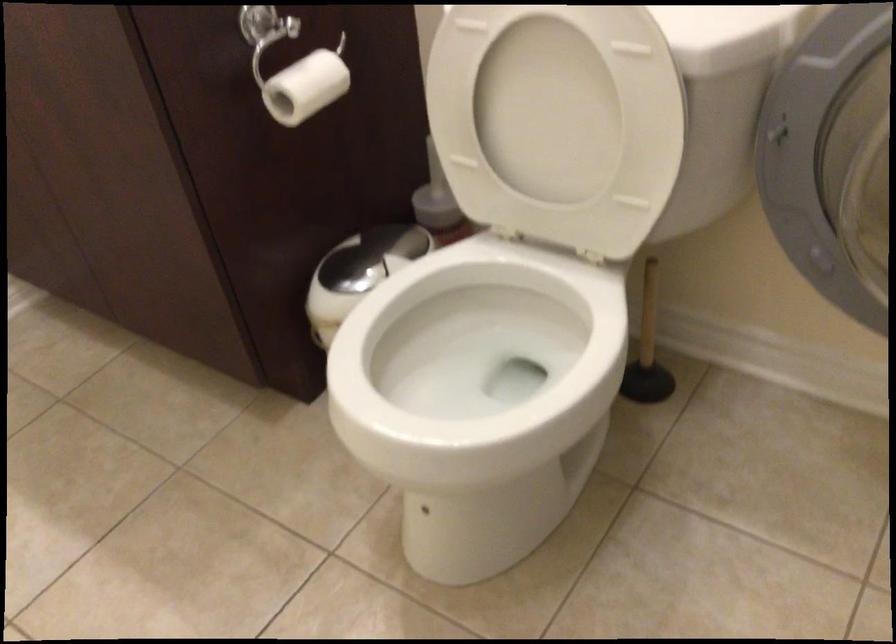
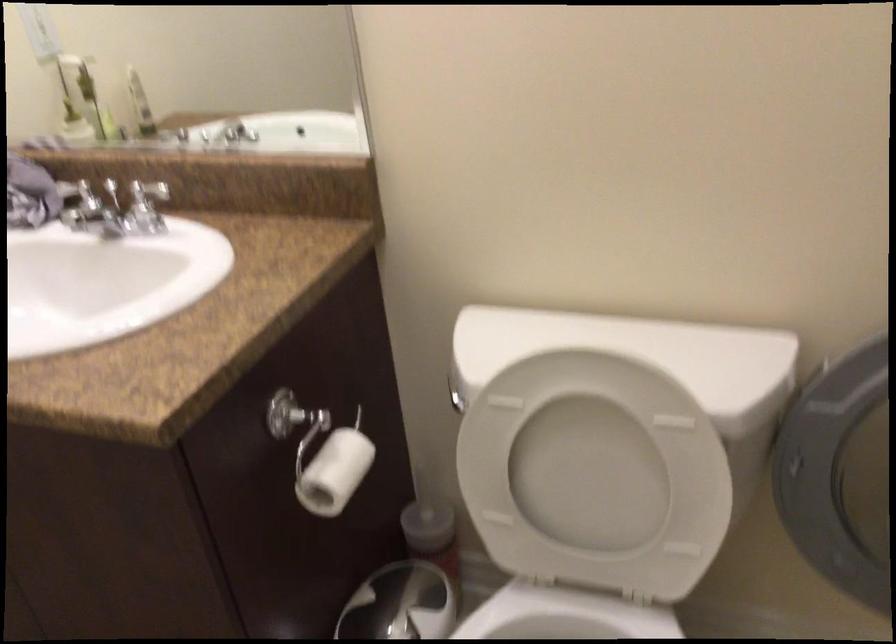
Where in the second image is the point corresponding to (513,270) from the first image?

(564, 616)